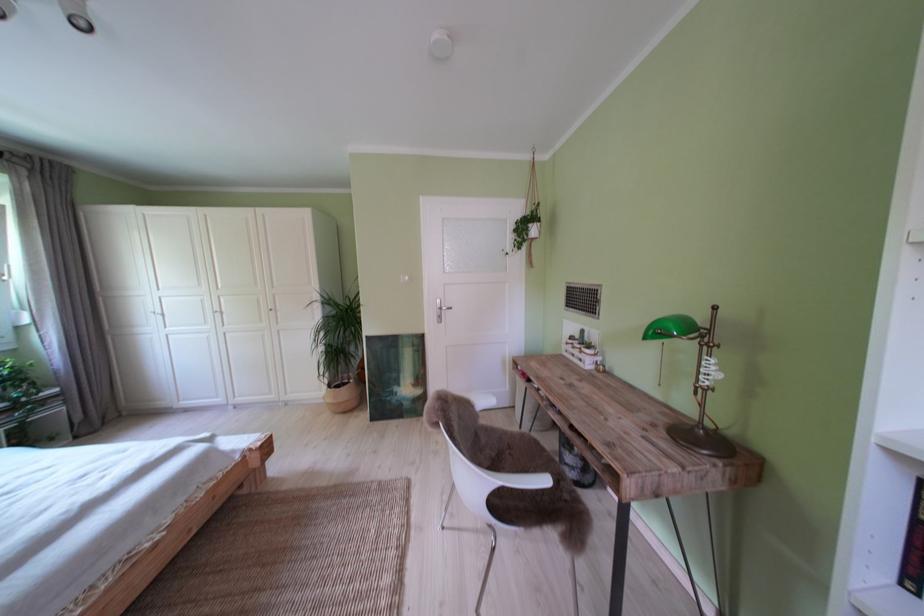
The image size is (924, 616). In order to click on chair sitting surface in this screenshot , I will do `click(514, 453)`.